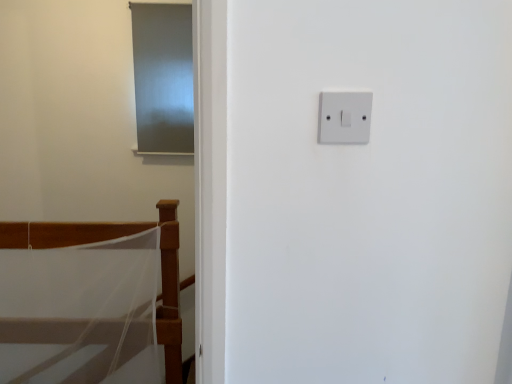
Question: Is white plastic light switch at upper right positioned with its back to white mesh bed at lower left?

Choices:
 (A) yes
 (B) no

Answer: (B)

Question: Can you confirm if white plastic light switch at upper right is smaller than white mesh bed at lower left?

Choices:
 (A) yes
 (B) no

Answer: (A)

Question: Is white plastic light switch at upper right directly adjacent to white mesh bed at lower left?

Choices:
 (A) no
 (B) yes

Answer: (A)

Question: From the image's perspective, would you say white plastic light switch at upper right is shown under white mesh bed at lower left?

Choices:
 (A) yes
 (B) no

Answer: (B)

Question: Can you confirm if white plastic light switch at upper right is thinner than white mesh bed at lower left?

Choices:
 (A) yes
 (B) no

Answer: (A)

Question: From the image's perspective, relative to matte gray screen door at upper left, is white plastic light switch at upper right above or below?

Choices:
 (A) above
 (B) below

Answer: (B)

Question: Relative to matte gray screen door at upper left, is white plastic light switch at upper right in front or behind?

Choices:
 (A) front
 (B) behind

Answer: (A)

Question: From a real-world perspective, relative to matte gray screen door at upper left, is white plastic light switch at upper right vertically above or below?

Choices:
 (A) below
 (B) above

Answer: (A)

Question: Is white plastic light switch at upper right wider or thinner than matte gray screen door at upper left?

Choices:
 (A) wide
 (B) thin

Answer: (B)

Question: Considering the positions of white plastic light switch at upper right and white mesh bed at lower left in the image, is white plastic light switch at upper right taller or shorter than white mesh bed at lower left?

Choices:
 (A) short
 (B) tall

Answer: (A)

Question: From the image's perspective, relative to white mesh bed at lower left, is white plastic light switch at upper right above or below?

Choices:
 (A) below
 (B) above

Answer: (B)

Question: In terms of width, does white plastic light switch at upper right look wider or thinner when compared to white mesh bed at lower left?

Choices:
 (A) wide
 (B) thin

Answer: (B)

Question: Is white plastic light switch at upper right situated inside white mesh bed at lower left or outside?

Choices:
 (A) outside
 (B) inside

Answer: (A)

Question: Looking at their shapes, would you say matte gray screen door at upper left is wider or thinner than white mesh bed at lower left?

Choices:
 (A) wide
 (B) thin

Answer: (B)

Question: From the image's perspective, is matte gray screen door at upper left located above or below white mesh bed at lower left?

Choices:
 (A) below
 (B) above

Answer: (B)